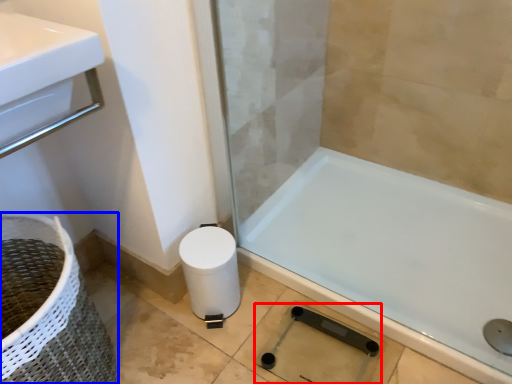
Question: Which object appears farthest to the camera in this image, shower (highlighted by a red box) or basket container (highlighted by a blue box)?

Choices:
 (A) shower
 (B) basket container

Answer: (A)